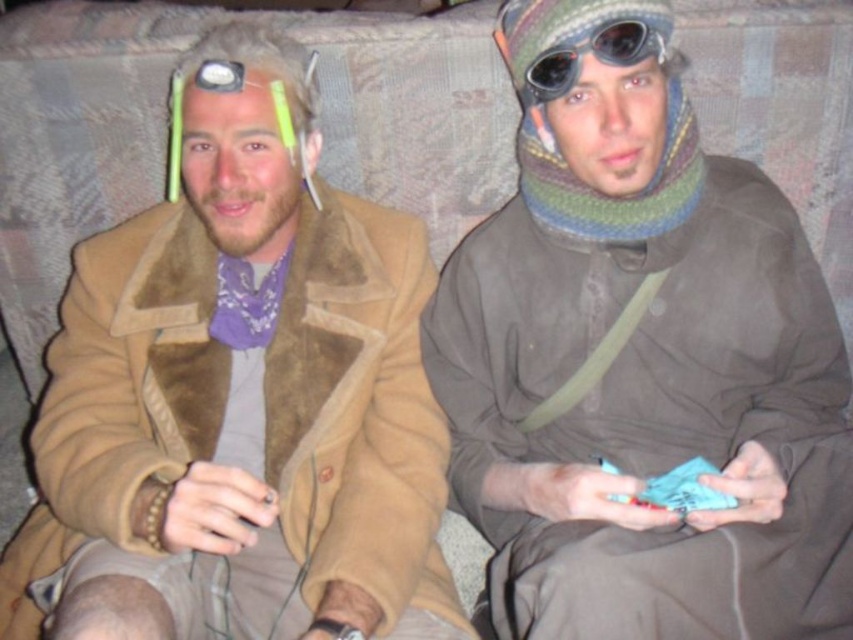
Does brown suede jacket at left have a greater width compared to black rubber goggles at upper center?

Yes.

Is point (248, 369) closer to viewer compared to point (575, 61)?

No, it is behind (575, 61).

Locate an element on the screen. brown suede jacket at left is located at coordinates (239, 401).

Is multicolored knitted scarf at center taller than brown suede jacket at left?

Yes.

Can you confirm if multicolored knitted scarf at center is positioned to the left of brown suede jacket at left?

No, multicolored knitted scarf at center is not to the left of brown suede jacket at left.

At what (x,y) coordinates should I click in order to perform the action: click on multicolored knitted scarf at center. Please return your answer as a coordinate pair (x, y). This screenshot has width=853, height=640. Looking at the image, I should click on (641, 369).

Does multicolored knitted scarf at center have a larger size compared to black rubber goggles at upper center?

Indeed, multicolored knitted scarf at center has a larger size compared to black rubber goggles at upper center.

Who is more distant from viewer, (654, 307) or (564, 83)?

The point (654, 307) is behind.

Is point (834, 557) more distant than point (624, 20)?

Yes, point (834, 557) is behind point (624, 20).

Find the location of a particular element. The height and width of the screenshot is (640, 853). multicolored knitted scarf at center is located at coordinates (641, 369).